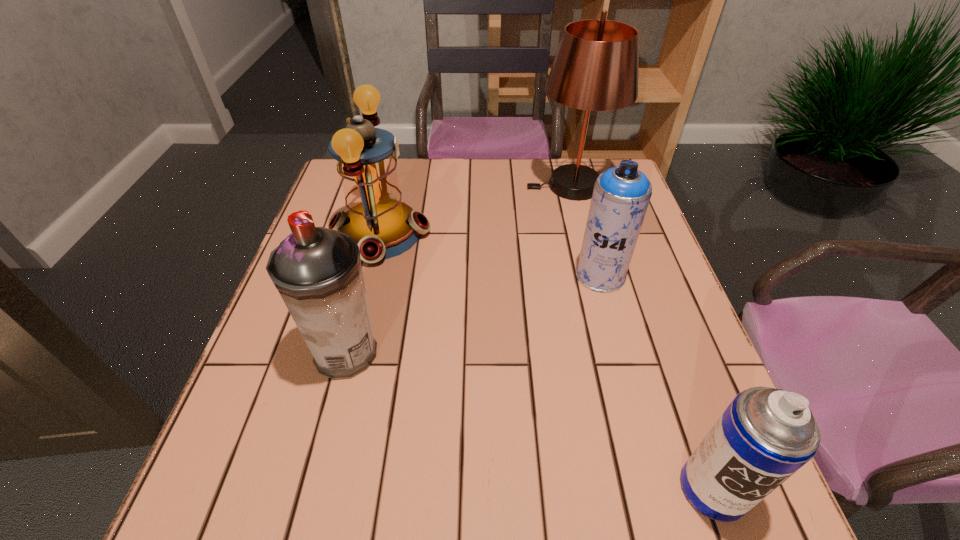
You are a GUI agent. You are given a task and a screenshot of the screen. Output one action in this format:
    pyautogui.click(x=<x>, y=<y>)
    Task: Click on the blank area in the image that satisfies the following two spatial constraints: 1. on the back side of the farthest aerosol can; 2. on the front-facing side of the tallest object
    Image resolution: width=960 pixels, height=540 pixels.
    Given the screenshot: What is the action you would take?
    pyautogui.click(x=576, y=186)

This screenshot has width=960, height=540. Find the location of `free space that satisfies the following two spatial constraints: 1. on the back side of the farthest aerosol can; 2. on the front-facing side of the tallest object`. free space that satisfies the following two spatial constraints: 1. on the back side of the farthest aerosol can; 2. on the front-facing side of the tallest object is located at coordinates (576, 186).